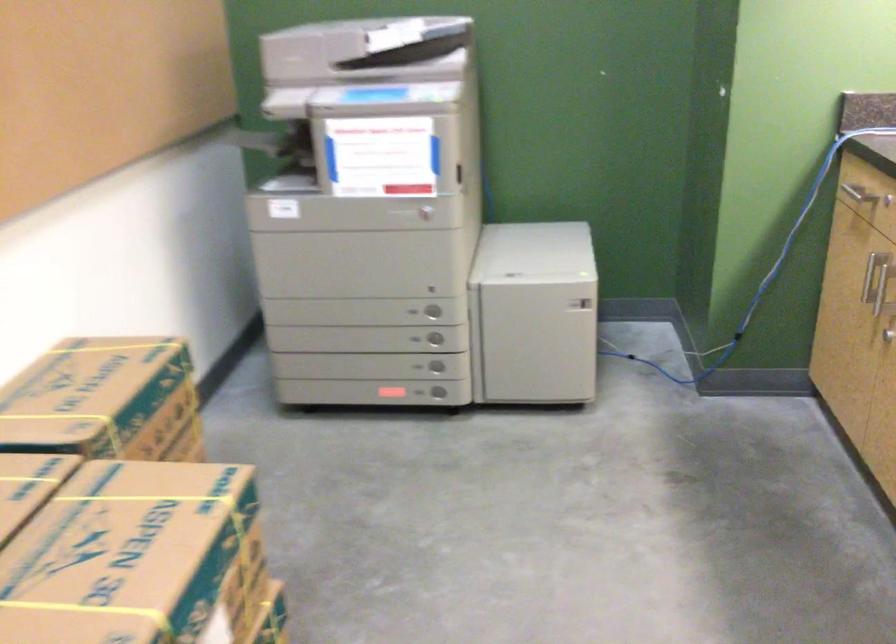
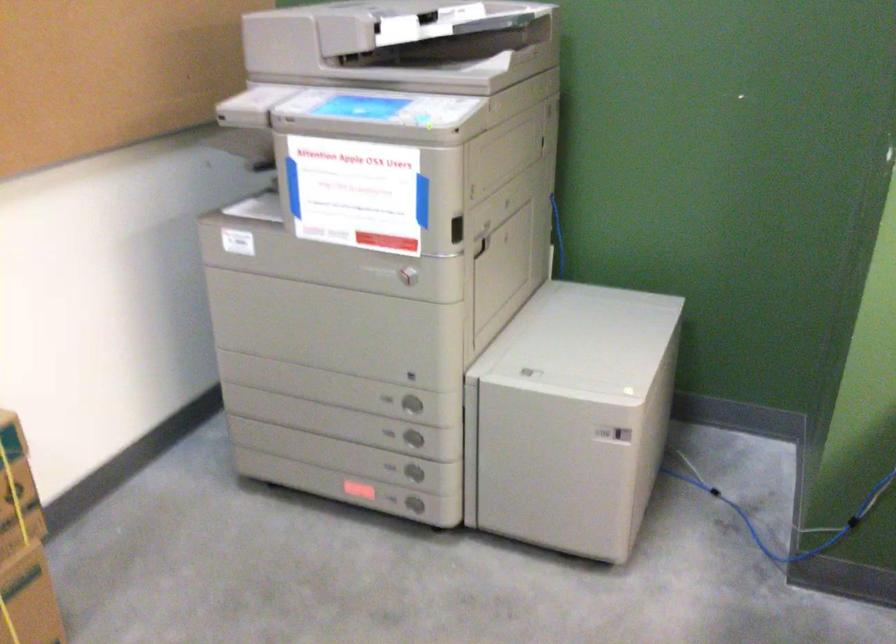
In the second image, find the point that corresponds to (x=435, y=339) in the first image.

(412, 438)